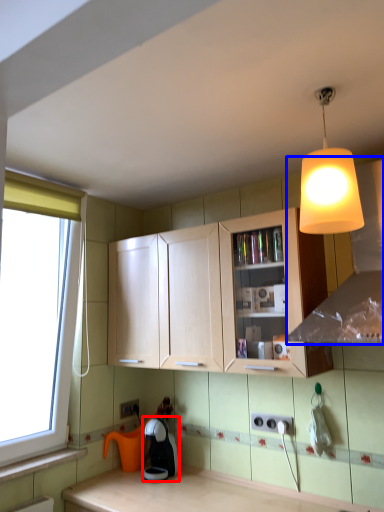
Question: Which point is further to the camera, coffee machine (highlighted by a red box) or exhaust hood (highlighted by a blue box)?

Choices:
 (A) coffee machine
 (B) exhaust hood

Answer: (A)